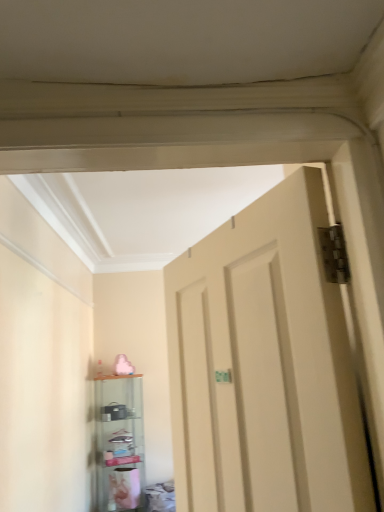
Question: Does matte beige door at center appear on the right side of transparent glass shelf at lower left?

Choices:
 (A) no
 (B) yes

Answer: (B)

Question: Is matte beige door at center placed right next to transparent glass shelf at lower left?

Choices:
 (A) no
 (B) yes

Answer: (A)

Question: From the image's perspective, would you say matte beige door at center is positioned over transparent glass shelf at lower left?

Choices:
 (A) no
 (B) yes

Answer: (B)

Question: Are matte beige door at center and transparent glass shelf at lower left located far from each other?

Choices:
 (A) yes
 (B) no

Answer: (A)

Question: Is matte beige door at center positioned beyond the bounds of transparent glass shelf at lower left?

Choices:
 (A) yes
 (B) no

Answer: (A)

Question: Is matte beige door at center at the left side of transparent glass shelf at lower left?

Choices:
 (A) yes
 (B) no

Answer: (B)

Question: From a real-world perspective, is transparent glass shelf at lower left over matte beige door at center?

Choices:
 (A) no
 (B) yes

Answer: (A)

Question: Is transparent glass shelf at lower left at the left side of matte beige door at center?

Choices:
 (A) no
 (B) yes

Answer: (B)

Question: Is the depth of transparent glass shelf at lower left greater than that of matte beige door at center?

Choices:
 (A) yes
 (B) no

Answer: (A)

Question: Is transparent glass shelf at lower left next to matte beige door at center?

Choices:
 (A) no
 (B) yes

Answer: (A)

Question: Is transparent glass shelf at lower left surrounding matte beige door at center?

Choices:
 (A) yes
 (B) no

Answer: (B)

Question: Is transparent glass shelf at lower left far from matte beige door at center?

Choices:
 (A) yes
 (B) no

Answer: (A)

Question: Would you say matte beige door at center is to the left or to the right of transparent glass shelf at lower left in the picture?

Choices:
 (A) left
 (B) right

Answer: (B)